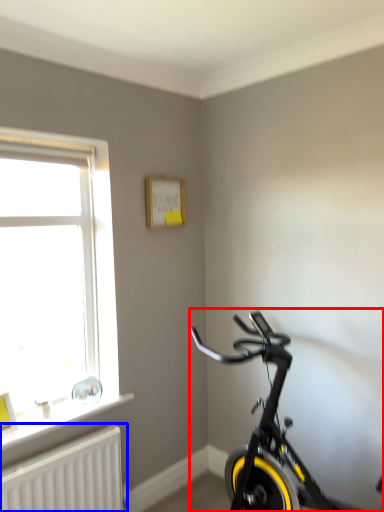
Question: Which object appears closest to the camera in this image, bicycle (highlighted by a red box) or radiator (highlighted by a blue box)?

Choices:
 (A) bicycle
 (B) radiator

Answer: (A)